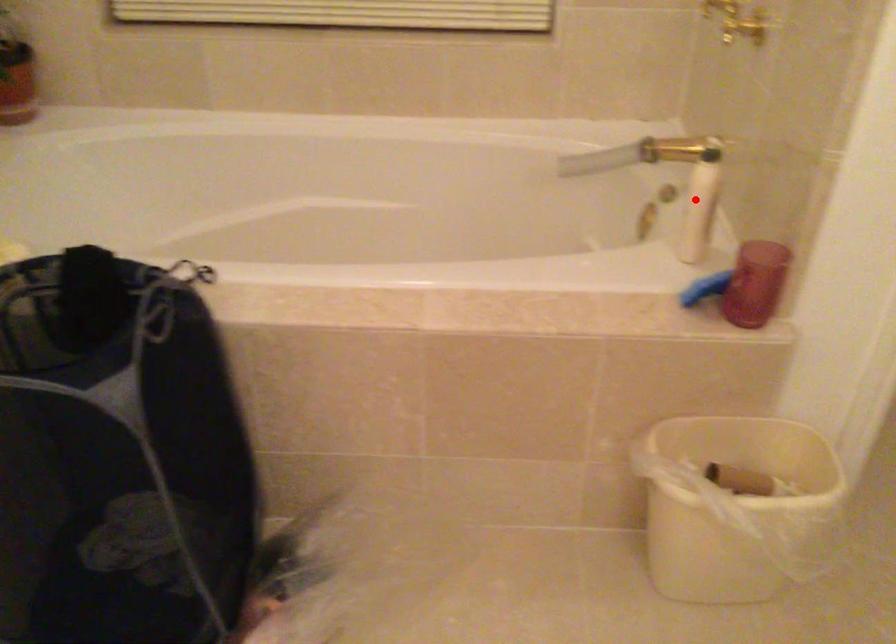
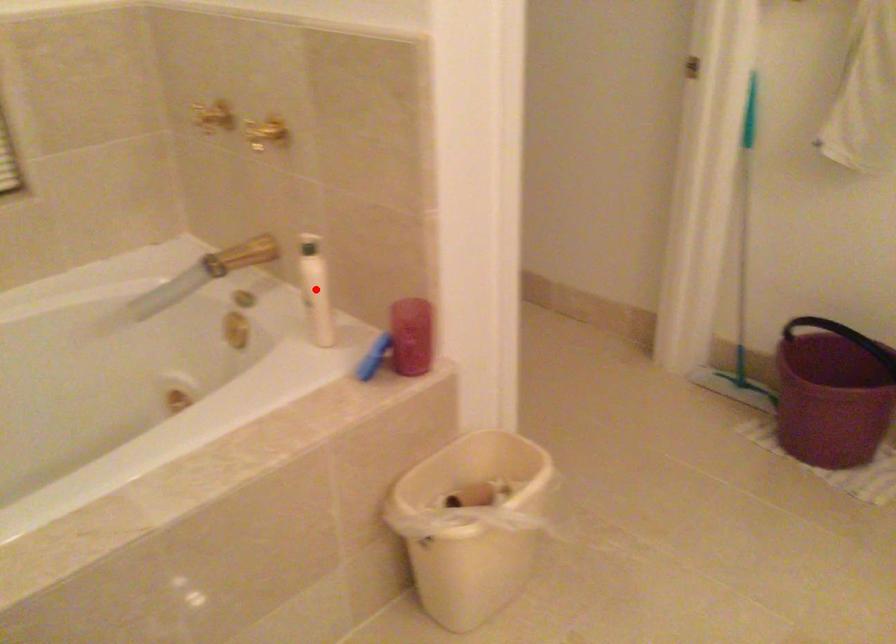
I am providing you with two images of the same scene from different viewpoints. A red point is marked on the first image and another point is marked on the second image. Is the red point in image1 aligned with the point shown in image2?

Yes